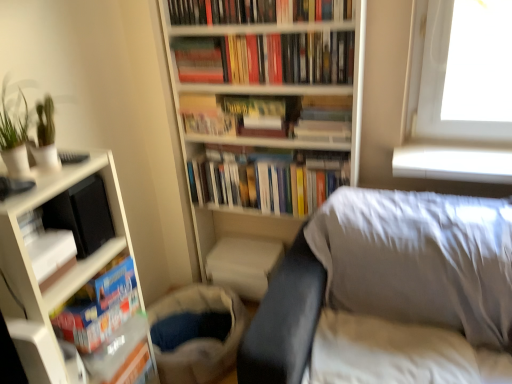
Question: Does point (251, 16) appear closer or farther from the camera than point (470, 379)?

Choices:
 (A) farther
 (B) closer

Answer: (A)

Question: Based on their positions, is hardcover books at upper center, acting as the 7th book starting from the bottom, located to the left or right of white fabric sheet at lower right?

Choices:
 (A) left
 (B) right

Answer: (A)

Question: Estimate the real-world distances between objects in this image. Which object is farther from the matte gray bed at center?

Choices:
 (A) white matte bookcase at center, which ranks as the 1th bookcase in right-to-left order
 (B) hardcover book at center, which is counted as the second paperback book, starting from the right
 (C) white matte book at lower left, which ranks as the 2th book in bottom-to-top order
 (D) white fabric sheet at lower right
 (E) hardcover book at center, acting as the 4th book starting from the bottom

Answer: (C)

Question: Considering the real-world distances, which object is closest to the white matte book at lower left, acting as the sixth book starting from the top?

Choices:
 (A) white fabric sheet at lower right
 (B) textured fabric bag at lower center
 (C) matte brown book at center, which is the 1th paperback book from right to left
 (D) hardcover book at center, which is counted as the fourth book, starting from the top
 (E) hardcover book at center, which is counted as the second paperback book, starting from the right

Answer: (B)